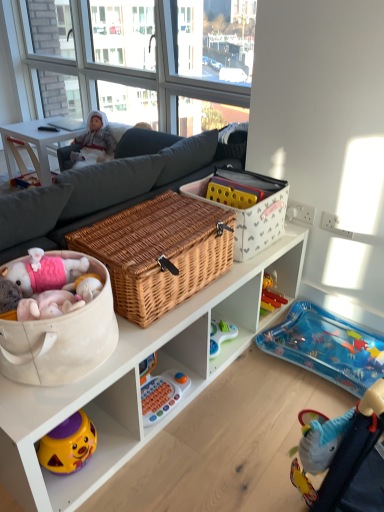
Question: Is white plush doll at upper left shorter than beige fabric basket at lower left, which appears as the second storage box when viewed from the right?

Choices:
 (A) yes
 (B) no

Answer: (B)

Question: Is white plush doll at upper left completely or partially outside of beige fabric basket at lower left, which is counted as the 1th storage box, starting from the front?

Choices:
 (A) no
 (B) yes

Answer: (B)

Question: Considering the relative sizes of white plush doll at upper left and beige fabric basket at lower left, the 2th storage box when ordered from back to front, in the image provided, is white plush doll at upper left taller than beige fabric basket at lower left, the 2th storage box when ordered from back to front,?

Choices:
 (A) no
 (B) yes

Answer: (B)

Question: From a real-world perspective, is white plush doll at upper left located beneath beige fabric basket at lower left, which is the first storage box in left-to-right order?

Choices:
 (A) yes
 (B) no

Answer: (A)

Question: Considering the relative sizes of white plush doll at upper left and beige fabric basket at lower left, which is counted as the 1th storage box, starting from the front, in the image provided, is white plush doll at upper left smaller than beige fabric basket at lower left, which is counted as the 1th storage box, starting from the front,?

Choices:
 (A) yes
 (B) no

Answer: (B)

Question: Considering their positions, is white wicker basket at upper center, the 2th storage box in the left-to-right sequence, located in front of or behind white plush doll at upper left?

Choices:
 (A) behind
 (B) front

Answer: (B)

Question: Considering the positions of white wicker basket at upper center, the first storage box from the back, and white plush doll at upper left in the image, is white wicker basket at upper center, the first storage box from the back, wider or thinner than white plush doll at upper left?

Choices:
 (A) thin
 (B) wide

Answer: (B)

Question: From a real-world perspective, relative to white plush doll at upper left, is white wicker basket at upper center, the 2th storage box in the left-to-right sequence, vertically above or below?

Choices:
 (A) below
 (B) above

Answer: (B)

Question: Which is correct: white wicker basket at upper center, the first storage box from the back, is inside white plush doll at upper left, or outside of it?

Choices:
 (A) outside
 (B) inside

Answer: (A)

Question: From the image's perspective, is transparent glass window at upper center above or below woven brown picnic basket at center?

Choices:
 (A) above
 (B) below

Answer: (A)

Question: Is transparent glass window at upper center taller or shorter than woven brown picnic basket at center?

Choices:
 (A) tall
 (B) short

Answer: (A)

Question: Considering the positions of transparent glass window at upper center and woven brown picnic basket at center in the image, is transparent glass window at upper center bigger or smaller than woven brown picnic basket at center?

Choices:
 (A) small
 (B) big

Answer: (B)

Question: From a real-world perspective, relative to woven brown picnic basket at center, is transparent glass window at upper center vertically above or below?

Choices:
 (A) below
 (B) above

Answer: (B)

Question: Does point (142, 415) appear closer or farther from the camera than point (274, 238)?

Choices:
 (A) farther
 (B) closer

Answer: (B)

Question: Considering the relative positions of orange plastic toy at center and white wicker basket at upper center, acting as the 1th storage box starting from the right, in the image provided, is orange plastic toy at center to the left or to the right of white wicker basket at upper center, acting as the 1th storage box starting from the right,?

Choices:
 (A) left
 (B) right

Answer: (A)